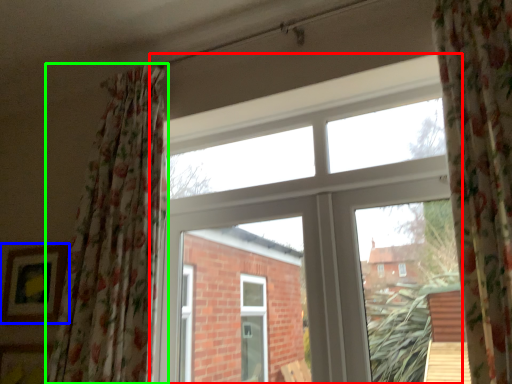
Question: Considering the real-world distances, which object is closest to window (highlighted by a red box)? picture frame (highlighted by a blue box) or curtain (highlighted by a green box).

Choices:
 (A) picture frame
 (B) curtain

Answer: (B)